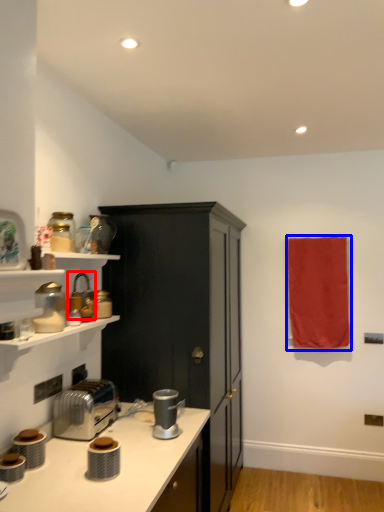
Question: Which object appears farthest to the camera in this image, appliance (highlighted by a red box) or beach towel (highlighted by a blue box)?

Choices:
 (A) appliance
 (B) beach towel

Answer: (B)